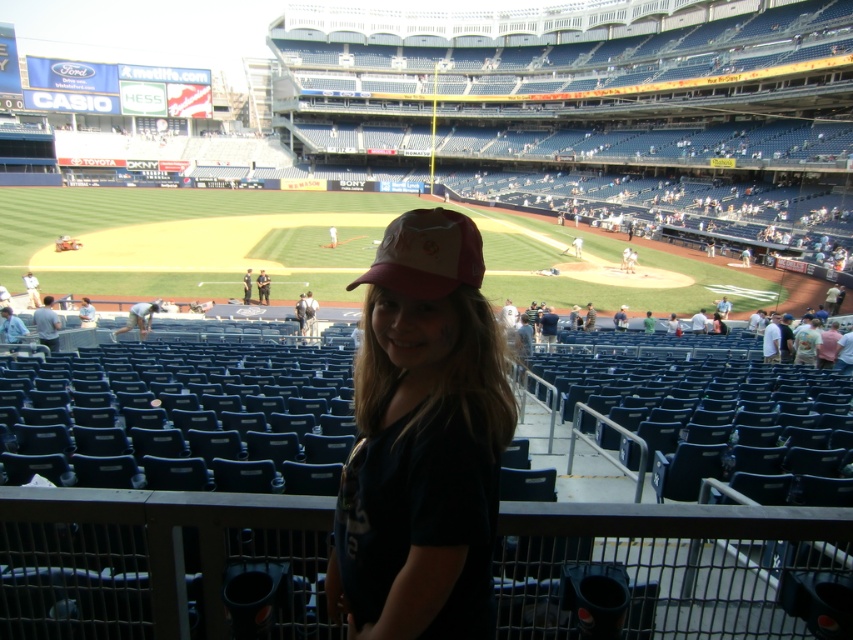
Question: Which point appears closest to the camera in this image?

Choices:
 (A) (344, 584)
 (B) (402, 224)

Answer: (B)

Question: Does pink fabric cap at center come behind pink fabric baseball cap at center?

Choices:
 (A) no
 (B) yes

Answer: (A)

Question: Among these objects, which one is nearest to the camera?

Choices:
 (A) pink fabric baseball cap at center
 (B) pink fabric cap at center

Answer: (B)

Question: Can you confirm if pink fabric cap at center is positioned below pink fabric baseball cap at center?

Choices:
 (A) no
 (B) yes

Answer: (B)

Question: Can you confirm if pink fabric cap at center is positioned to the right of pink fabric baseball cap at center?

Choices:
 (A) yes
 (B) no

Answer: (B)

Question: Which point is closer to the camera?

Choices:
 (A) pink fabric cap at center
 (B) pink fabric baseball cap at center

Answer: (A)